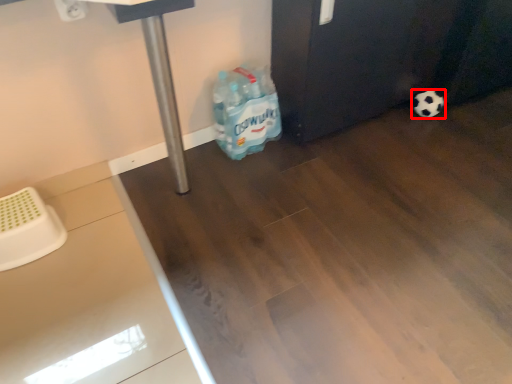
Question: Considering the relative positions of football (annotated by the red box) and cleaning product in the image provided, where is football (annotated by the red box) located with respect to the staircase?

Choices:
 (A) left
 (B) right

Answer: (B)